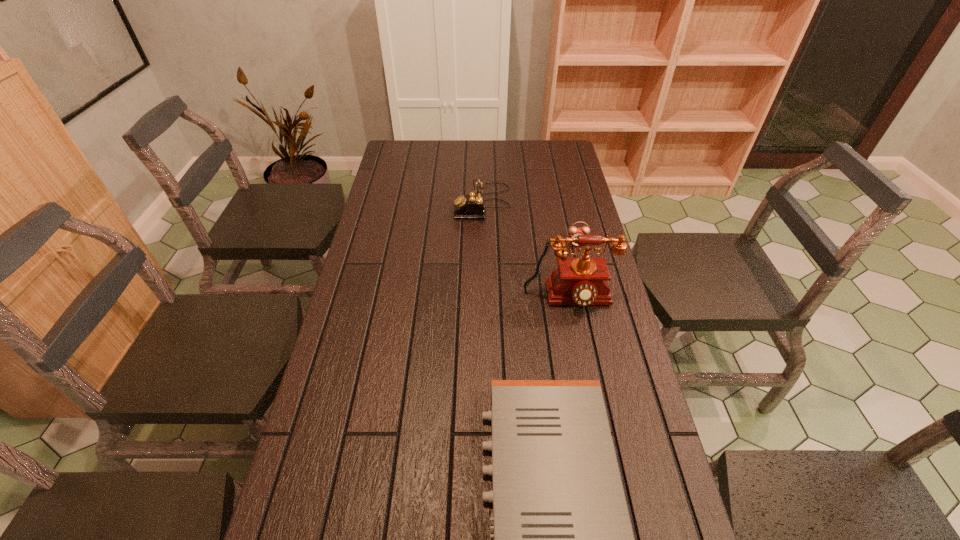
Where is `the second nearest object`? Image resolution: width=960 pixels, height=540 pixels. the second nearest object is located at coordinates (582, 281).

Where is `the nearer telephone`? The height and width of the screenshot is (540, 960). the nearer telephone is located at coordinates (582, 281).

Locate an element on the screen. The height and width of the screenshot is (540, 960). the third shortest object is located at coordinates point(471,206).

Where is `the farther telephone`? The image size is (960, 540). the farther telephone is located at coordinates (471, 206).

In order to click on the third nearest object in this screenshot , I will do `click(573, 230)`.

This screenshot has height=540, width=960. Find the location of `vacant space located 0.320m on the dial of the taller telephone`. vacant space located 0.320m on the dial of the taller telephone is located at coordinates point(593,424).

You are a GUI agent. You are given a task and a screenshot of the screen. Output one action in this format:
    pyautogui.click(x=<x>, y=<y>)
    Task: Click on the free space located on the dial of the farthest object
    
    Given the screenshot: What is the action you would take?
    pyautogui.click(x=403, y=202)

The image size is (960, 540). I want to click on free space located 0.140m on the dial of the farthest object, so click(417, 202).

Locate an element on the screen. Image resolution: width=960 pixels, height=540 pixels. free region located 0.140m on the dial of the farthest object is located at coordinates (417, 202).

Locate an element on the screen. free space located 0.080m on the clock face of the third nearest object is located at coordinates (582, 264).